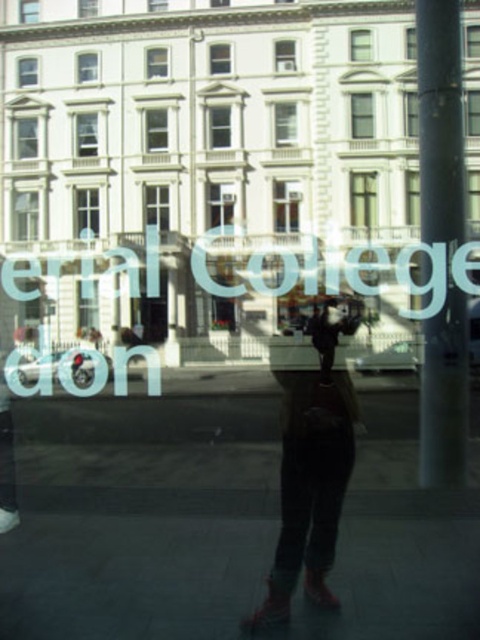
You are looking through the window and see two points in the image. The first point is at coordinate point (17, 550) and the second is at point (330, 381). Which point is closer to you?

Point (17, 550) is closer to the camera than point (330, 381).

You are looking through the window and see two points in the image. The first point is at coordinate point(466, 593) and the second point is at coordinate point(457, 108). Which point is closer to you?

Point(466, 593) is closer to the camera than point(457, 108).